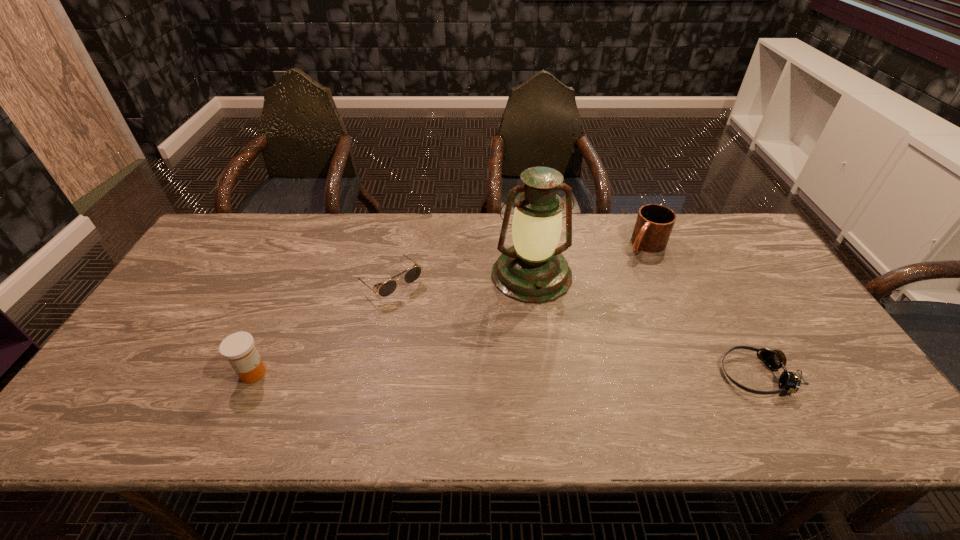
You are a GUI agent. You are given a task and a screenshot of the screen. Output one action in this format:
    pyautogui.click(x=<x>, y=<y>)
    Task: Click on the vacant space at the left edge of the desktop
    This screenshot has height=540, width=960.
    Given the screenshot: What is the action you would take?
    pyautogui.click(x=192, y=276)

In the image, there is a desktop. Where is `free region at the right edge`? The width and height of the screenshot is (960, 540). free region at the right edge is located at coordinates (769, 294).

Where is `free point at the far right corner`? Image resolution: width=960 pixels, height=540 pixels. free point at the far right corner is located at coordinates (715, 231).

In the image, there is a desktop. Where is `vacant region at the near right corner`? This screenshot has height=540, width=960. vacant region at the near right corner is located at coordinates (813, 392).

Where is `vacant space in between the mug and the goggles`? This screenshot has width=960, height=540. vacant space in between the mug and the goggles is located at coordinates (701, 310).

I want to click on vacant space in between the mug and the goggles, so click(701, 310).

Where is `vacant region between the goggles and the second object from left to right`? This screenshot has width=960, height=540. vacant region between the goggles and the second object from left to right is located at coordinates (572, 328).

Locate an element on the screen. vacant area that lies between the shortest object and the medicine is located at coordinates (504, 374).

The height and width of the screenshot is (540, 960). What are the coordinates of `vacant area that lies between the goggles and the tallest object` in the screenshot? It's located at (643, 325).

This screenshot has height=540, width=960. I want to click on vacant space that's between the medicine and the goggles, so click(504, 374).